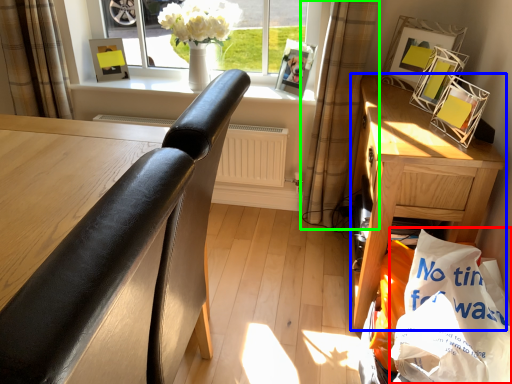
Question: Which object is the farthest from shopping bag (highlighted by a red box)? Choose among these: nightstand (highlighted by a blue box) or curtain (highlighted by a green box).

Choices:
 (A) nightstand
 (B) curtain

Answer: (B)